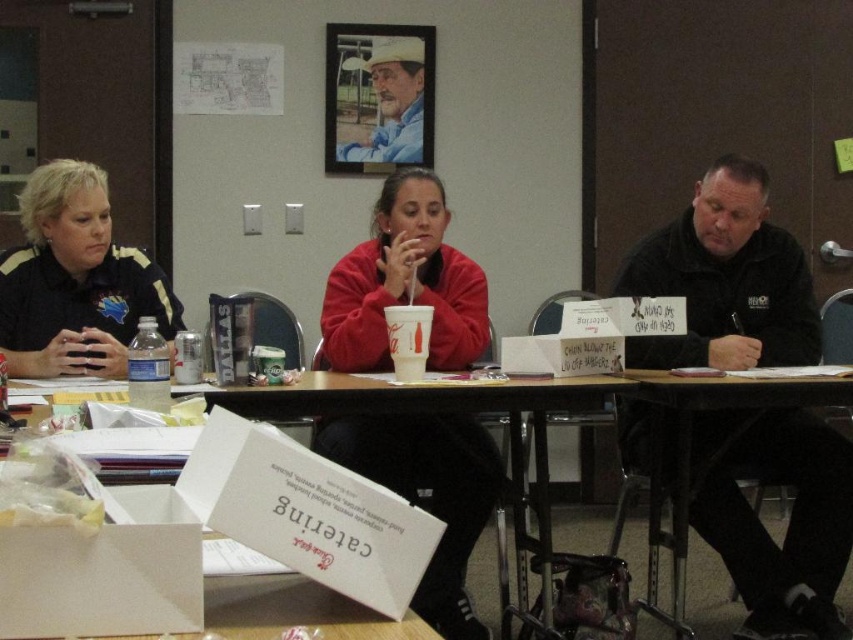
Which of these two, black matte jacket at center or rustic wood frame at upper center, stands shorter?

rustic wood frame at upper center

This screenshot has width=853, height=640. Describe the element at coordinates (724, 280) in the screenshot. I see `black matte jacket at center` at that location.

Locate an element on the screen. This screenshot has width=853, height=640. black matte jacket at center is located at coordinates (724, 280).

Image resolution: width=853 pixels, height=640 pixels. Identify the location of black matte jacket at center. (724, 280).

How distant is matte red sweater at center from white cardboard box at lower center?

The distance of matte red sweater at center from white cardboard box at lower center is 12.39 inches.

Does matte red sweater at center have a larger size compared to white cardboard box at lower center?

No, matte red sweater at center is not bigger than white cardboard box at lower center.

This screenshot has width=853, height=640. Find the location of `matte red sweater at center`. matte red sweater at center is located at coordinates 404,282.

Which is more to the right, matte red sweater at center or rustic wood frame at upper center?

matte red sweater at center

Is matte red sweater at center taller than rustic wood frame at upper center?

Indeed, matte red sweater at center has a greater height compared to rustic wood frame at upper center.

Who is more distant from viewer, (381, 268) or (393, 129)?

The point (393, 129) is behind.

Find the location of a particular element. The image size is (853, 640). matte red sweater at center is located at coordinates (404, 282).